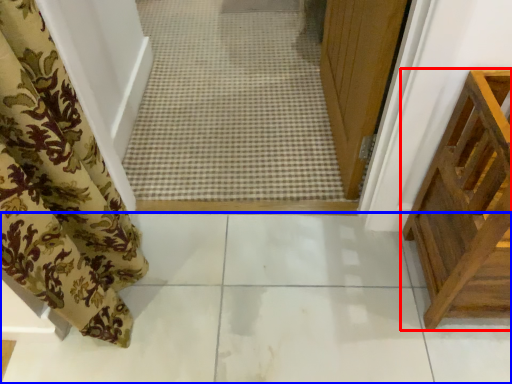
Question: Which object is further to the camera taking this photo, furniture (highlighted by a red box) or path (highlighted by a blue box)?

Choices:
 (A) furniture
 (B) path

Answer: (B)